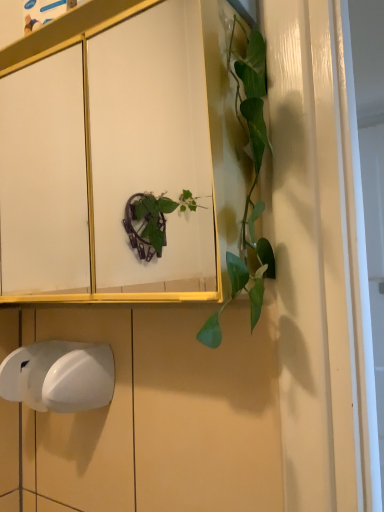
Question: Would you say white glossy cabinet at upper center is to the left or to the right of white plastic hand dryer at lower left in the picture?

Choices:
 (A) right
 (B) left

Answer: (A)

Question: Considering the positions of white glossy cabinet at upper center and white plastic hand dryer at lower left in the image, is white glossy cabinet at upper center bigger or smaller than white plastic hand dryer at lower left?

Choices:
 (A) small
 (B) big

Answer: (B)

Question: Considering their positions, is white glossy cabinet at upper center located in front of or behind white plastic hand dryer at lower left?

Choices:
 (A) behind
 (B) front

Answer: (B)

Question: Considering the relative positions of white plastic hand dryer at lower left and white glossy cabinet at upper center in the image provided, is white plastic hand dryer at lower left to the left or to the right of white glossy cabinet at upper center?

Choices:
 (A) right
 (B) left

Answer: (B)

Question: From the image's perspective, is white plastic hand dryer at lower left positioned above or below white glossy cabinet at upper center?

Choices:
 (A) above
 (B) below

Answer: (B)

Question: Is point (74, 351) closer or farther from the camera than point (102, 69)?

Choices:
 (A) farther
 (B) closer

Answer: (B)

Question: In terms of height, does white plastic hand dryer at lower left look taller or shorter compared to white glossy cabinet at upper center?

Choices:
 (A) short
 (B) tall

Answer: (A)